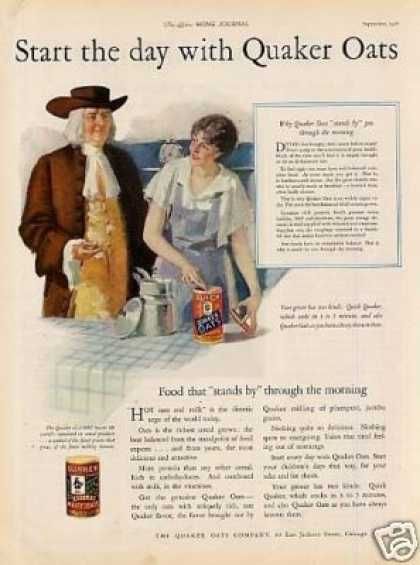
At what (x,y) coordinates should I click in order to perform the action: click on tub. Please return your answer as a coordinate pair (x, y). The width and height of the screenshot is (420, 565). Looking at the image, I should click on (80, 478).